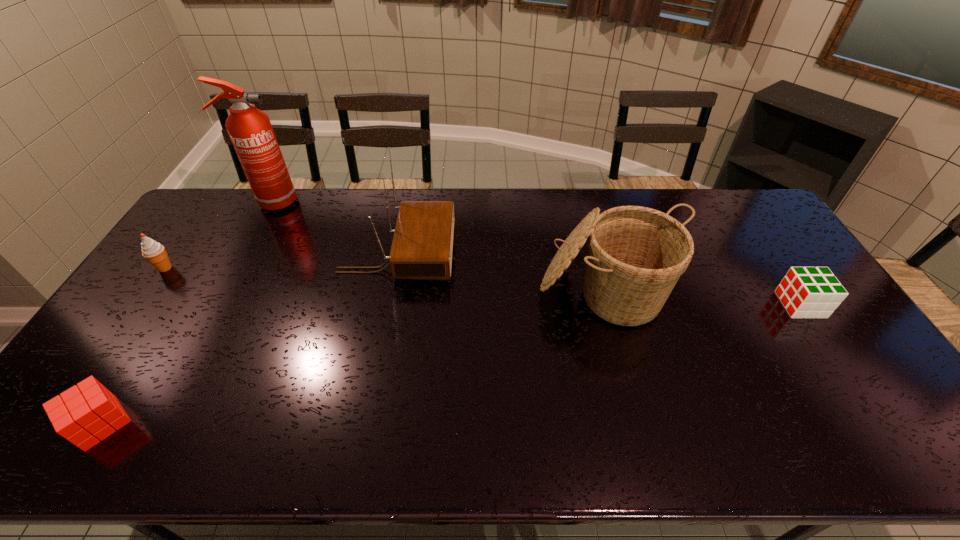
Where is `vacant space located 0.310m at the nozzle of the farthest object`? This screenshot has height=540, width=960. vacant space located 0.310m at the nozzle of the farthest object is located at coordinates (381, 202).

The image size is (960, 540). What are the coordinates of `vacant region located on the front panel of the third object from right to left` in the screenshot? It's located at (540, 253).

Where is `vacant space located on the front of the second object from right to left`? Image resolution: width=960 pixels, height=540 pixels. vacant space located on the front of the second object from right to left is located at coordinates (645, 436).

Identify the location of blank space located on the right of the third shortest object. (281, 268).

Locate an element on the screen. Image resolution: width=960 pixels, height=540 pixels. free spot located on the red face of the rightmost object is located at coordinates (710, 305).

Locate an element on the screen. vacant area situated on the red face of the rightmost object is located at coordinates (721, 305).

Locate an element on the screen. vacant space located on the red face of the rightmost object is located at coordinates (708, 305).

Find the location of `free space located on the right of the nearest object`. free space located on the right of the nearest object is located at coordinates (270, 423).

Where is `fire extinguisher positioned at the far edge`? fire extinguisher positioned at the far edge is located at coordinates (250, 130).

The width and height of the screenshot is (960, 540). I want to click on radio_receiver that is at the far edge, so click(422, 245).